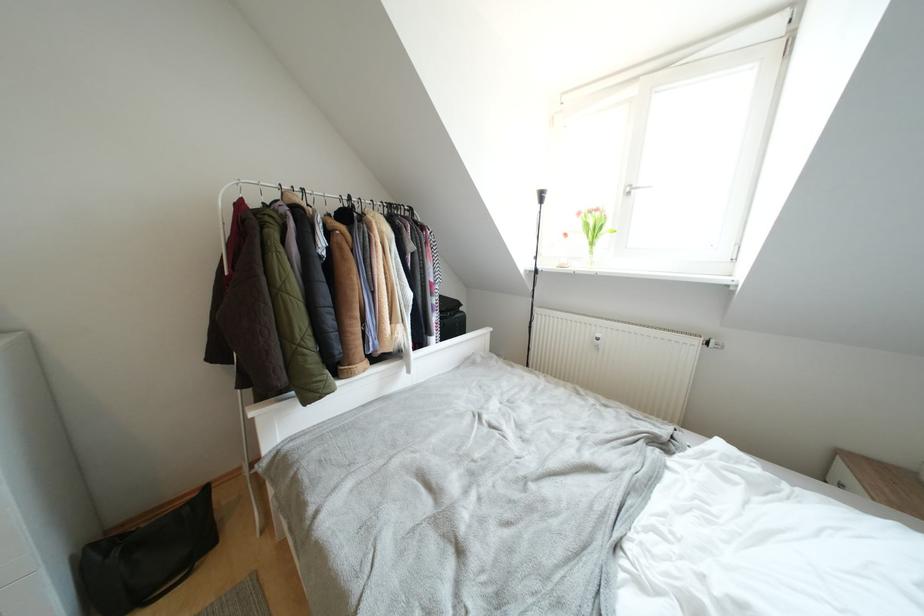
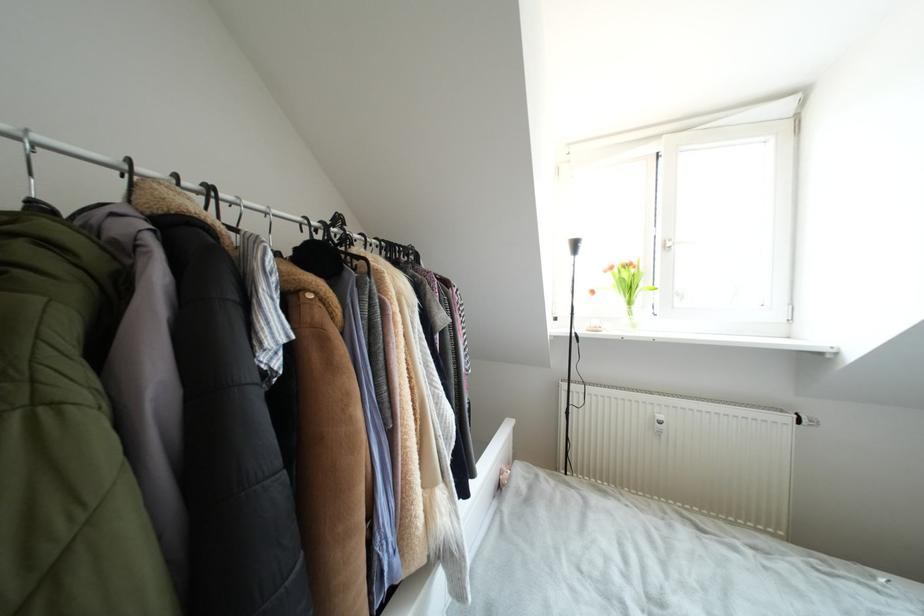
Question: The first image is from the beginning of the video and the second image is from the end. How did the camera likely rotate when shooting the video?

Choices:
 (A) Left
 (B) Right
 (C) Up
 (D) Down

Answer: (B)